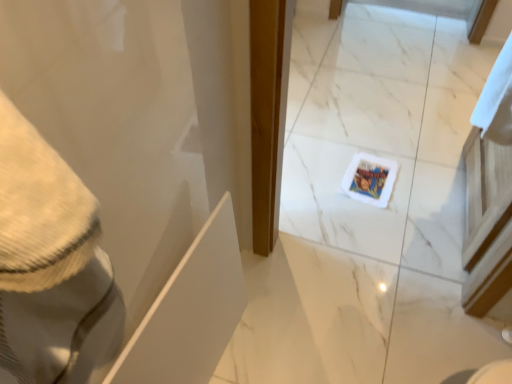
Find the location of `empty space that is to the right of white plastic container at center`. empty space that is to the right of white plastic container at center is located at coordinates (421, 190).